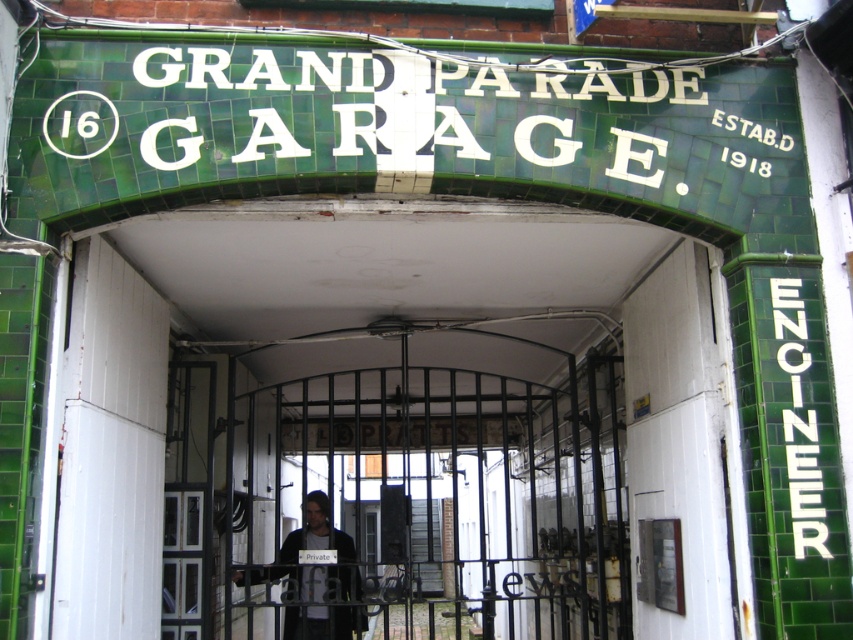
Is white tile/engineer sign at right below dark gray jacket at center?

No.

Where is `white tile/engineer sign at right`? The image size is (853, 640). white tile/engineer sign at right is located at coordinates (799, 420).